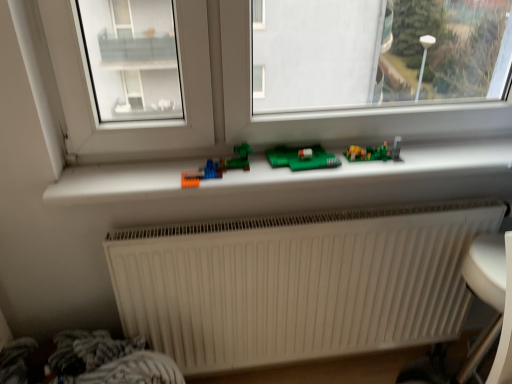
The width and height of the screenshot is (512, 384). I want to click on blank space situated above white ribbed radiator at lower center (from a real-world perspective), so click(x=307, y=223).